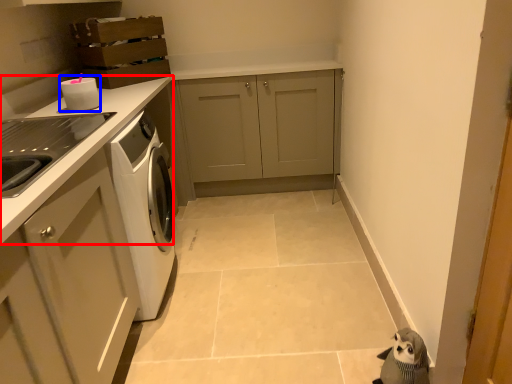
Question: Which point is further to the camera, countertop (highlighted by a red box) or appliance (highlighted by a blue box)?

Choices:
 (A) countertop
 (B) appliance

Answer: (B)